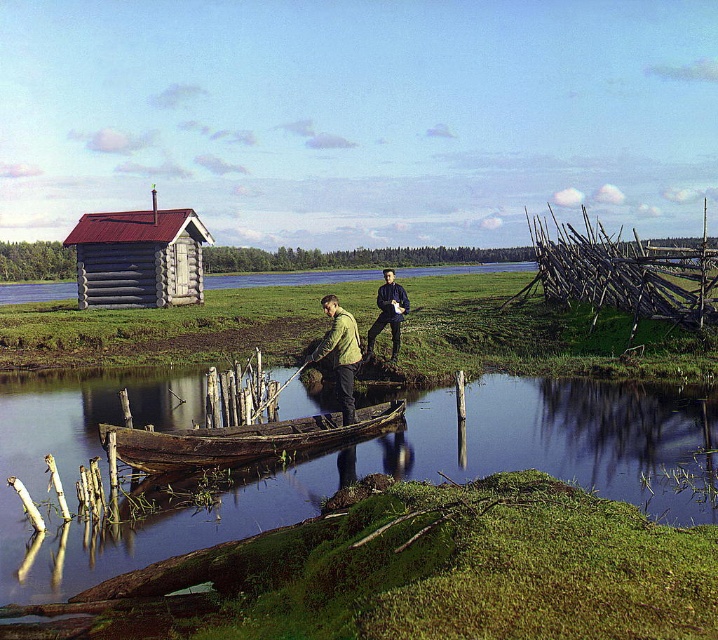
Between clear water at boat center and wooden canoe at center, which one appears on the right side from the viewer's perspective?

clear water at boat center is more to the right.

Is clear water at boat center further to the viewer compared to wooden canoe at center?

No.

Is point (358, 456) farther from viewer compared to point (116, 449)?

Yes, point (358, 456) is behind point (116, 449).

Where is `clear water at boat center`? This screenshot has width=718, height=640. clear water at boat center is located at coordinates (342, 461).

Find the location of a particular element. clear water at boat center is located at coordinates (342, 461).

Where is `clear water at boat center`? The width and height of the screenshot is (718, 640). clear water at boat center is located at coordinates (342, 461).

Who is positioned more to the right, wooden canoe at center or dark blue jeans at center?

From the viewer's perspective, dark blue jeans at center appears more on the right side.

This screenshot has width=718, height=640. Find the location of `wooden canoe at center`. wooden canoe at center is located at coordinates (243, 440).

Is point (359, 432) closer to viewer compared to point (373, 339)?

Yes, point (359, 432) is in front of point (373, 339).

The width and height of the screenshot is (718, 640). I want to click on wooden canoe at center, so click(x=243, y=440).